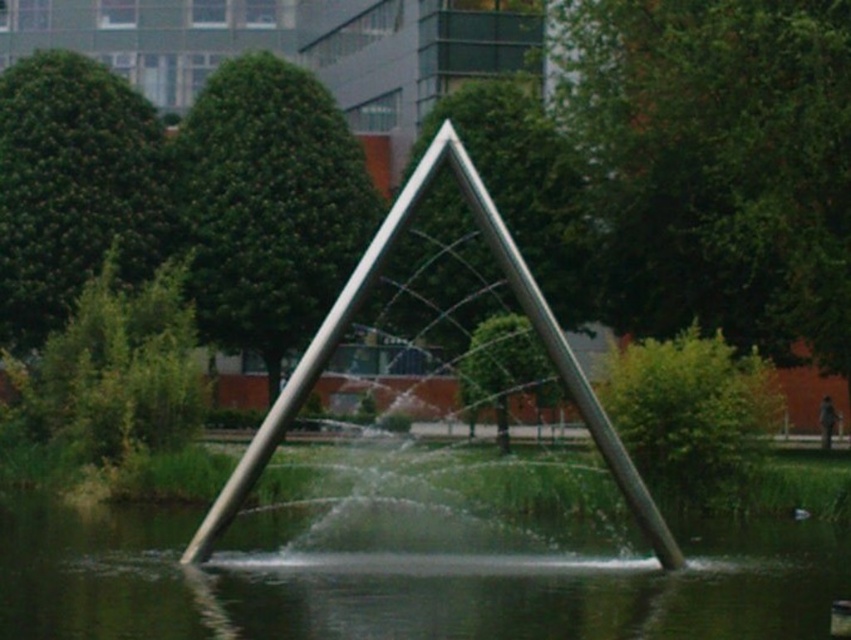
Question: Is clear water at center below polished metal fountain at center?

Choices:
 (A) no
 (B) yes

Answer: (B)

Question: Which object appears closest to the camera in this image?

Choices:
 (A) polished metal fountain at center
 (B) clear water at center

Answer: (B)

Question: Is clear water at center bigger than polished metal fountain at center?

Choices:
 (A) yes
 (B) no

Answer: (B)

Question: Which of the following is the closest to the observer?

Choices:
 (A) polished metal fountain at center
 (B) clear water at center

Answer: (B)

Question: Is clear water at center smaller than polished metal fountain at center?

Choices:
 (A) no
 (B) yes

Answer: (B)